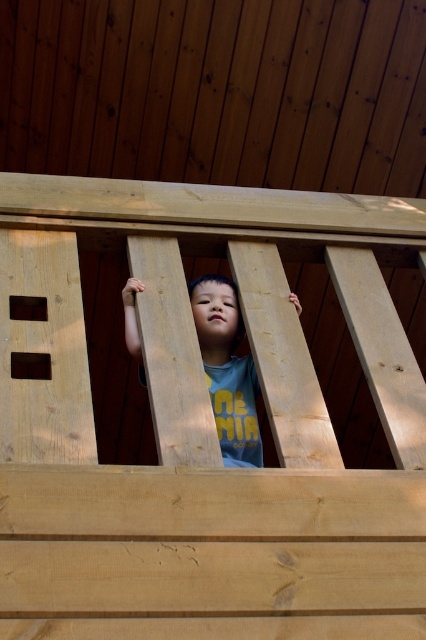
Is point (146, 518) more distant than point (206, 337)?

That is False.

Which is in front, point (144, 321) or point (123, 294)?

Point (144, 321)

Where is `natural wood bunk bed at center`? The height and width of the screenshot is (640, 426). natural wood bunk bed at center is located at coordinates (204, 424).